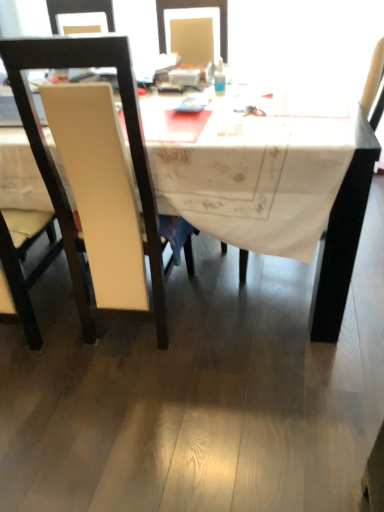
Question: Does white fabric table at center have a smaller size compared to translucent plastic bottle at upper center?

Choices:
 (A) no
 (B) yes

Answer: (A)

Question: Is translucent plastic bottle at upper center located within white fabric table at center?

Choices:
 (A) no
 (B) yes

Answer: (A)

Question: Is white fabric table at center shorter than translucent plastic bottle at upper center?

Choices:
 (A) no
 (B) yes

Answer: (A)

Question: Does white fabric table at center have a greater width compared to translucent plastic bottle at upper center?

Choices:
 (A) no
 (B) yes

Answer: (B)

Question: From the image's perspective, is white fabric table at center under translucent plastic bottle at upper center?

Choices:
 (A) no
 (B) yes

Answer: (B)

Question: Is white fabric table at center at the left side of translucent plastic bottle at upper center?

Choices:
 (A) yes
 (B) no

Answer: (A)

Question: Considering the relative sizes of white matte chair at left, the first chair in the left-to-right sequence, and white fabric table at center in the image provided, is white matte chair at left, the first chair in the left-to-right sequence, shorter than white fabric table at center?

Choices:
 (A) no
 (B) yes

Answer: (A)

Question: Is white matte chair at left, the first chair in the left-to-right sequence, oriented towards white fabric table at center?

Choices:
 (A) no
 (B) yes

Answer: (B)

Question: From the image's perspective, is white matte chair at left, which is the 2th chair in right-to-left order, above white fabric table at center?

Choices:
 (A) yes
 (B) no

Answer: (B)

Question: Is white matte chair at left, the first chair in the left-to-right sequence, in contact with white fabric table at center?

Choices:
 (A) yes
 (B) no

Answer: (B)

Question: Considering the relative sizes of white matte chair at left, the first chair in the left-to-right sequence, and white fabric table at center in the image provided, is white matte chair at left, the first chair in the left-to-right sequence, taller than white fabric table at center?

Choices:
 (A) no
 (B) yes

Answer: (B)

Question: Is white matte chair at left, the first chair in the left-to-right sequence, positioned behind white fabric table at center?

Choices:
 (A) yes
 (B) no

Answer: (B)

Question: Is white fabric table at center positioned in front of white matte chair at left, which is the 2th chair in right-to-left order?

Choices:
 (A) no
 (B) yes

Answer: (A)